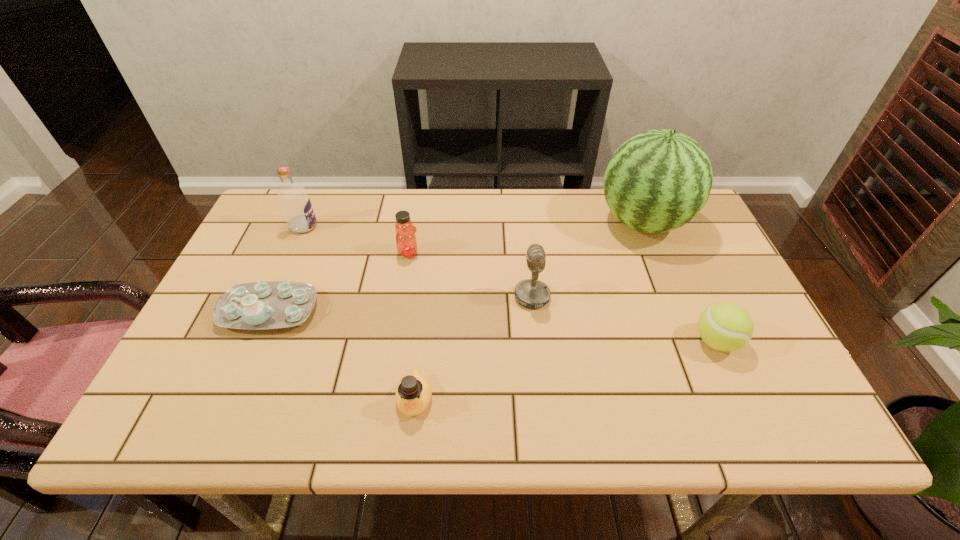
Where is `vacant space at the far right corner of the desktop`? The image size is (960, 540). vacant space at the far right corner of the desktop is located at coordinates (696, 215).

Locate an element on the screen. This screenshot has width=960, height=540. free space between the vodka and the tennis ball is located at coordinates (510, 284).

Find the location of `unoccupied position between the tennis ball and the fifth shortest object`. unoccupied position between the tennis ball and the fifth shortest object is located at coordinates (624, 319).

At what (x,y) coordinates should I click in order to perform the action: click on vacant region between the tennis ball and the chinaware. Please return your answer as a coordinate pair (x, y). The image size is (960, 540). Looking at the image, I should click on (492, 326).

The height and width of the screenshot is (540, 960). In order to click on vacant space in between the watermelon and the tennis ball in this screenshot , I will do `click(680, 282)`.

The width and height of the screenshot is (960, 540). Find the location of `free space between the watermelon and the fifth object from left to right`. free space between the watermelon and the fifth object from left to right is located at coordinates (588, 260).

The height and width of the screenshot is (540, 960). What are the coordinates of `free space between the honey and the vodka` in the screenshot? It's located at (356, 239).

Image resolution: width=960 pixels, height=540 pixels. What are the coordinates of `vacant region between the tallest object and the honey` in the screenshot? It's located at (526, 238).

Where is `empty location between the tallest object and the chinaware`? The image size is (960, 540). empty location between the tallest object and the chinaware is located at coordinates (456, 266).

Image resolution: width=960 pixels, height=540 pixels. In order to click on free spot between the chinaware and the duck in this screenshot , I will do `click(342, 354)`.